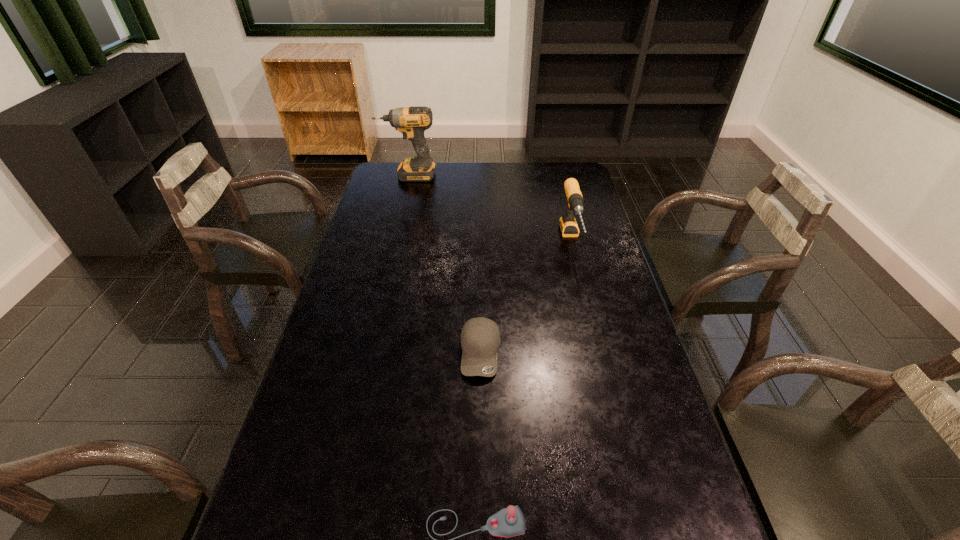
The height and width of the screenshot is (540, 960). Find the location of `object that is at the far left corner`. object that is at the far left corner is located at coordinates (411, 121).

In the image, there is a desktop. Where is `vacant space at the far edge`? vacant space at the far edge is located at coordinates (445, 180).

In the image, there is a desktop. Find the location of `free region at the left edge`. free region at the left edge is located at coordinates (325, 340).

This screenshot has width=960, height=540. I want to click on vacant space at the right edge of the desktop, so click(x=610, y=302).

Where is `free space at the far left corner of the desktop`? This screenshot has height=540, width=960. free space at the far left corner of the desktop is located at coordinates (379, 171).

At what (x,y) coordinates should I click in order to perform the action: click on free point at the far right corner. Please return your answer as a coordinate pair (x, y). The width and height of the screenshot is (960, 540). Looking at the image, I should click on (581, 182).

Identify the location of vacant space that is in between the second nearest object and the left drill. The width and height of the screenshot is (960, 540). (444, 264).

In order to click on vacant area that lies between the farther drill and the right drill in this screenshot , I will do `click(490, 208)`.

Where is `empty location between the baseball cap and the taller drill`? empty location between the baseball cap and the taller drill is located at coordinates (444, 264).

Point out which object is positioned as the third nearest to the second nearest object. Please provide its 2D coordinates. Your answer should be formatted as a tuple, i.e. [(x, y)], where the tuple contains the x and y coordinates of a point satisfying the conditions above.

[(411, 121)]